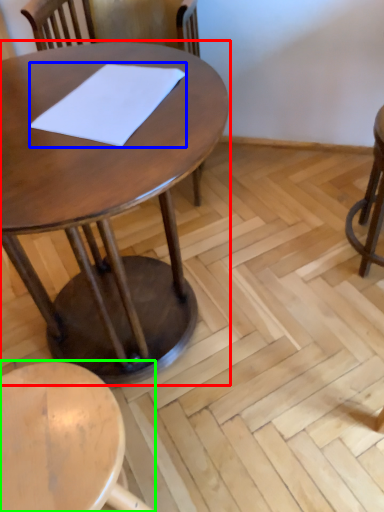
Question: Based on their relative distances, which object is farther from table (highlighted by a red box)? Choose from notepad (highlighted by a blue box) and stool (highlighted by a green box).

Choices:
 (A) notepad
 (B) stool

Answer: (B)